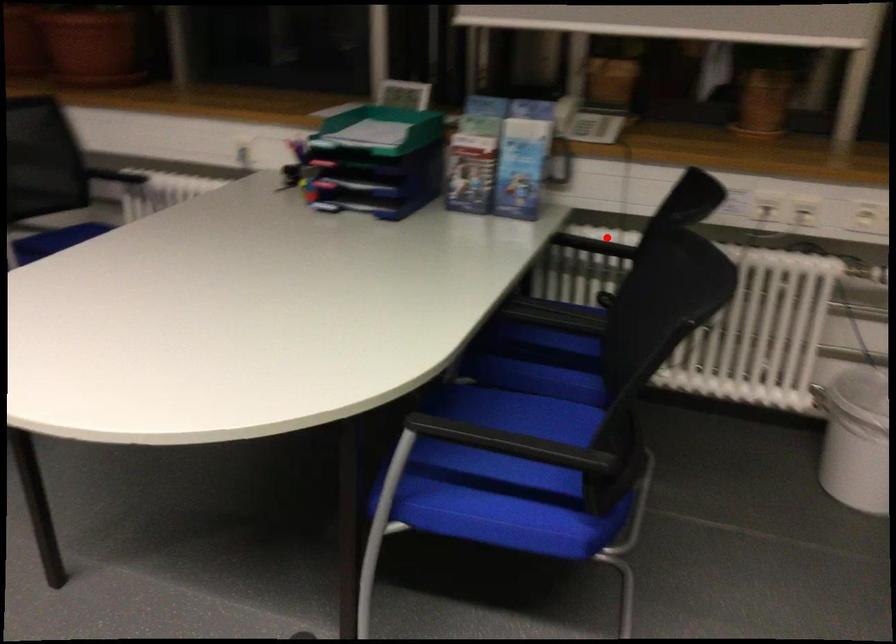
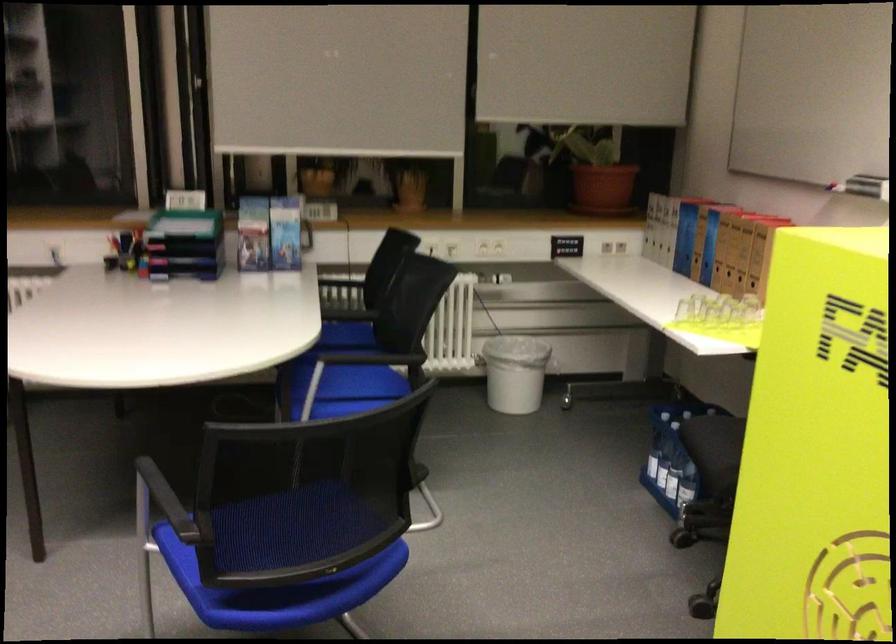
Question: A red point is marked in image1. In image2, is the corresponding 3D point closer to the camera or farther? Reply with the corresponding letter.

Choices:
 (A) The corresponding 3D point is closer.
 (B) The corresponding 3D point is farther.

Answer: (B)